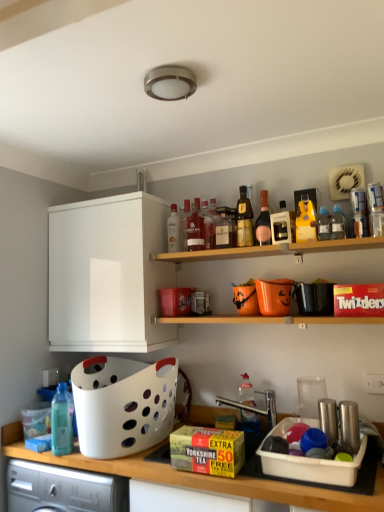
Question: In terms of width, does translucent glass bottle at center, which is counted as the fifth bottle, starting from the left, look wider or thinner when compared to white plastic basket at lower left?

Choices:
 (A) thin
 (B) wide

Answer: (A)

Question: From a real-world perspective, relative to white plastic basket at lower left, is translucent glass bottle at center, the 8th bottle viewed from the right, vertically above or below?

Choices:
 (A) below
 (B) above

Answer: (B)

Question: Which is farther from the translucent glass bottle at center, the sixth bottle from the left?

Choices:
 (A) matte glass bottle at upper center, the 3th bottle when ordered from left to right
 (B) clear glass bottle at center, the 2th bottle positioned from the left
 (C) black plastic bag at upper right, which appears as the 1th appliance when viewed from the back
 (D) translucent plastic bottle at center, the eighth bottle positioned from the left
 (E) pink glass bottle at upper center, the 4th bottle from the right

Answer: (D)

Question: Which is nearer to the clear plastic bottle at upper right, which is the 11th bottle from left to right?

Choices:
 (A) yellow matte bottle at upper center, which ranks as the 3th bottle in right-to-left order
 (B) white plastic basket at lower left
 (C) matte glass bottle at center, which appears as the fourth bottle when viewed from the left
 (D) white matte cabinet at upper left
 (E) pink glass bottle at upper center, the 4th bottle from the right

Answer: (A)